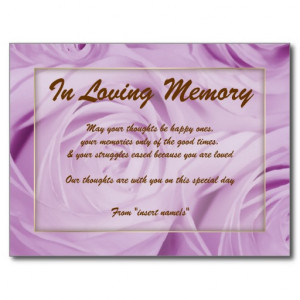
This screenshot has height=300, width=300. In order to click on gold border in this screenshot , I will do `click(264, 212)`.